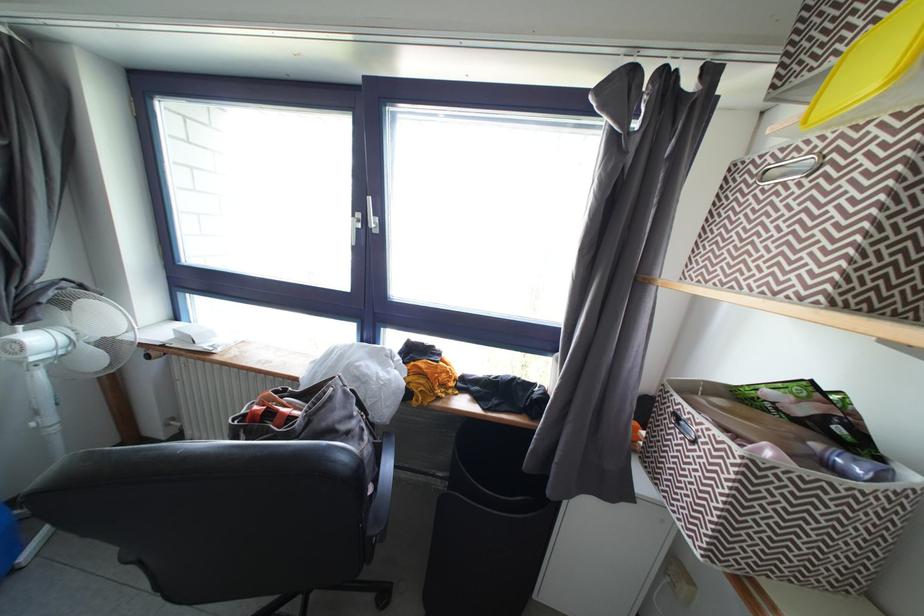
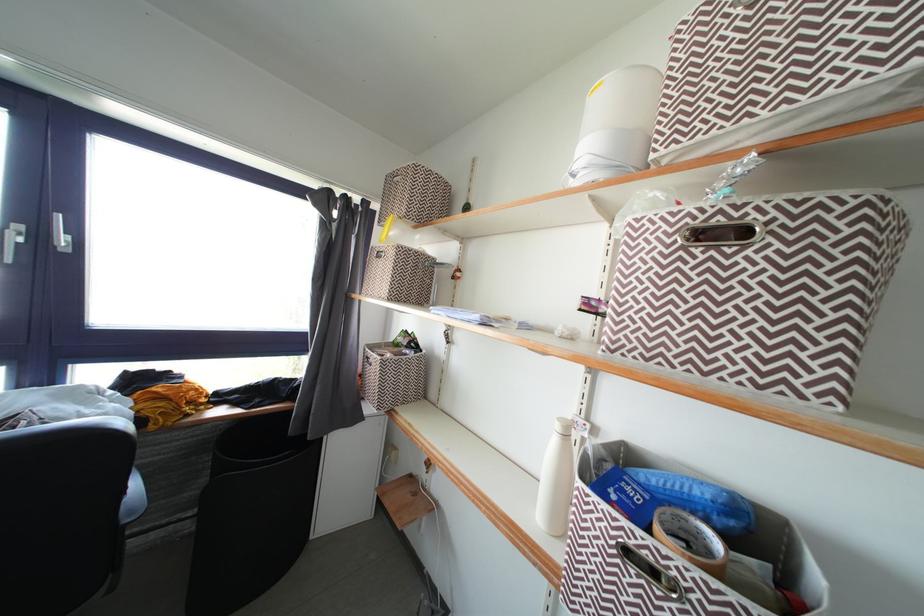
Locate, in the second image, the point that corresponds to point 380,225 in the first image.

(70, 245)